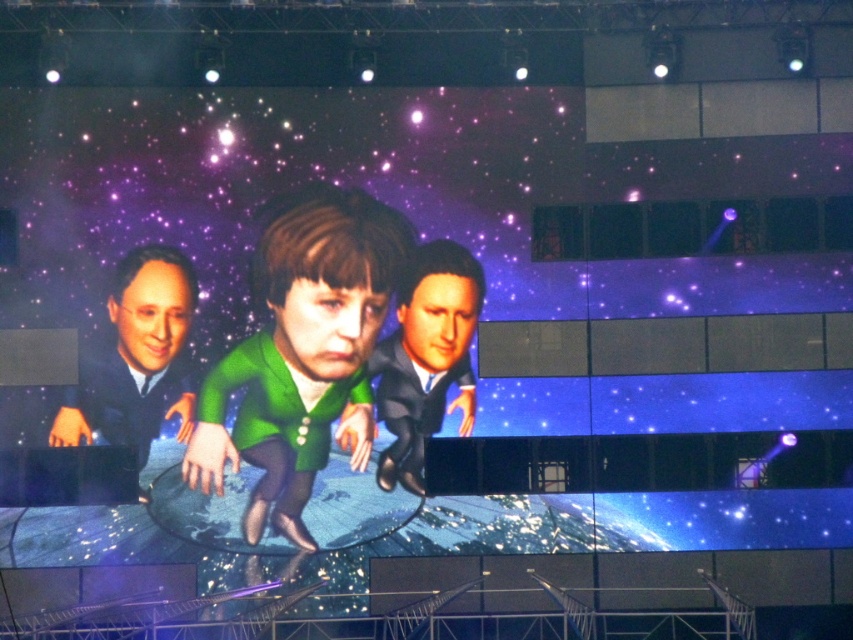
You are an event coordinator standing at the back of the venue. You need to ensure that the two performers wearing the green matte jacket at center and the matte black suit at left can hear each other during their dialogue. Given that the minimum distance for clear audio transmission between performers is 5 meters, will they be able to hear each other clearly?

The green matte jacket at center is 5.48 meters away from the matte black suit at left. Since the minimum required distance for clear audio transmission is 5 meters, the distance of 5.48 meters exceeds this threshold. Therefore, the performers will be able to hear each other clearly.

You are an event coordinator trying to position a spotlight on the green matte jacket at center during the performance. Given that the stage coordinates are mapped from 0 to 1 on both axes, can you confirm if the jacket is positioned within the central 30x30 area of the stage?

The green matte jacket at center is located at point (x=302, y=353). To determine if it is within the central 30x30 area, we calculate the range from 0.35 to 0.65 on both axes. Since 0.553 is between 0.35 and 0.65, and 0.355 is also within that range, the jacket is indeed positioned within the central 30x30 area of the stage.

You are a photographer at the event, and you need to capture a closeup shot of the green matte jacket at center. The camera you are using has a maximum focus range of 40 meters. Can you take the photo from your current position?

The green matte jacket at center is 39.78 meters from the camera, which is within the camera maximum focus range of 40 meters. Therefore, you can take the photo from your current position.